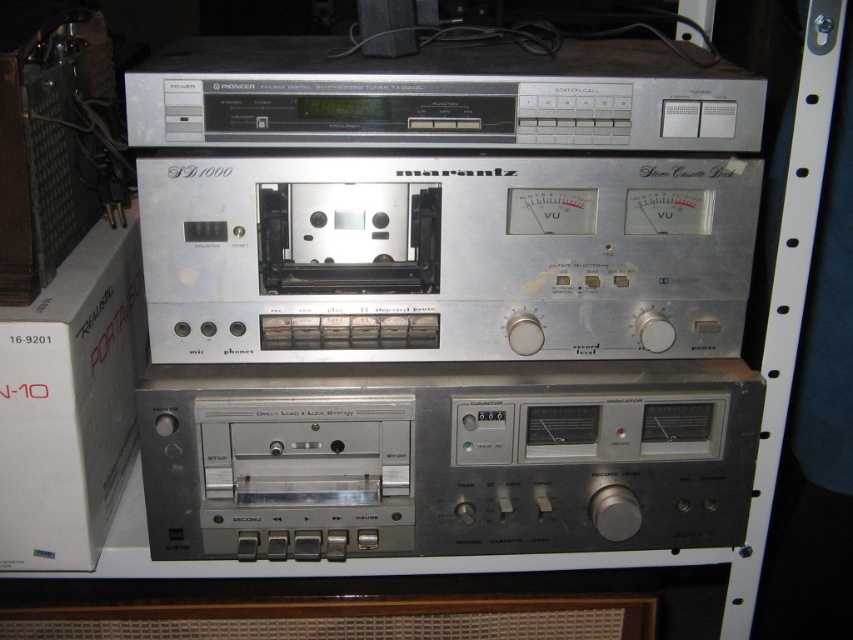
From the picture: Who is shorter, silver metallic cassette at center or metallic silver cassette at center?

silver metallic cassette at center is shorter.

Is silver metallic cassette at center positioned behind metallic silver cassette at center?

That is False.

Describe the element at coordinates (445, 257) in the screenshot. I see `silver metallic cassette at center` at that location.

Identify the location of silver metallic cassette at center. The height and width of the screenshot is (640, 853). (445, 257).